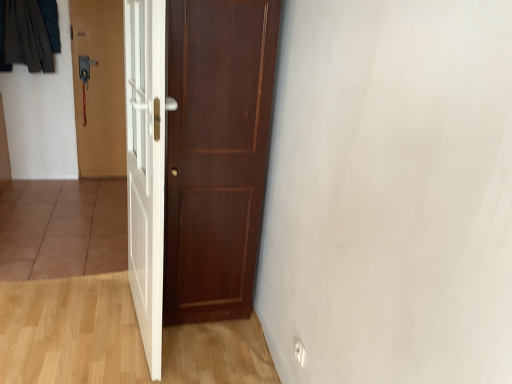
The image size is (512, 384). I want to click on vacant space in between white glossy door at center, which is the first door from front to back, and matte wood door at center, marked as the second door in a front-to-back arrangement, so click(x=195, y=347).